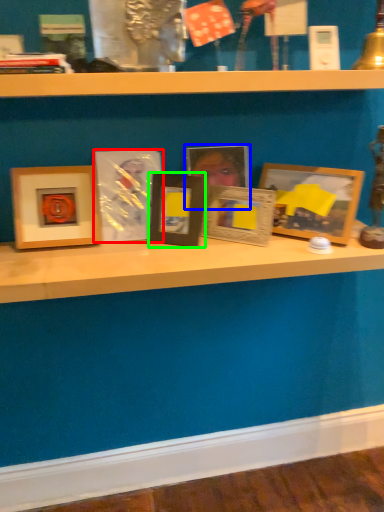
Question: Considering the real-world distances, which object is farthest from picture frame (highlighted by a red box)? picture frame (highlighted by a blue box) or picture frame (highlighted by a green box)?

Choices:
 (A) picture frame
 (B) picture frame

Answer: (A)